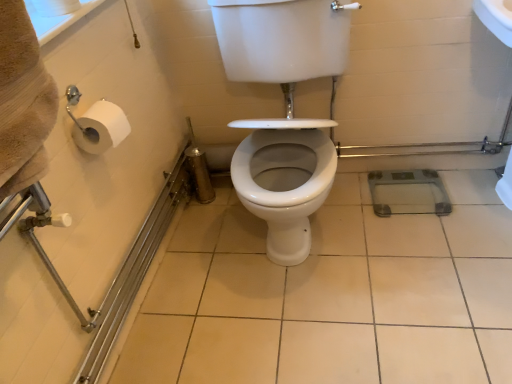
Identify the location of vacant space to the left of white glossy toilet seat at center. This screenshot has width=512, height=384. (199, 261).